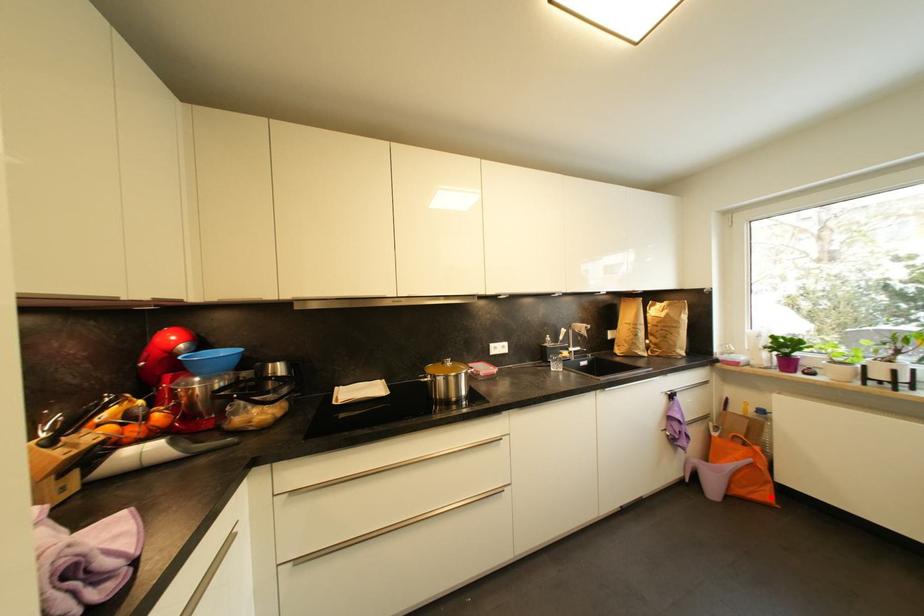
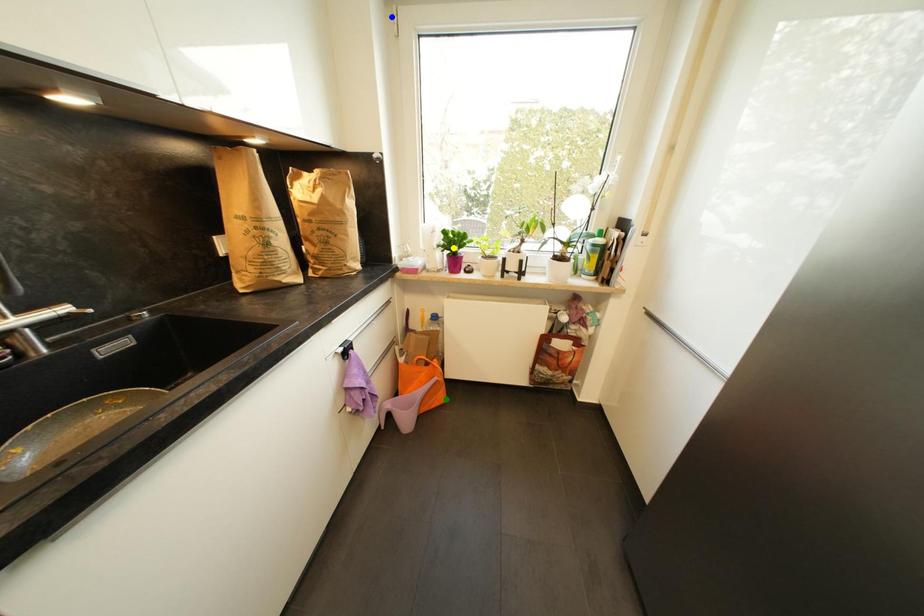
Question: I am providing you with two images of the same scene from different viewpoints. A red point is marked on the first image. You are given multiple points on the second image. Which point in image 2 is actually the same real-world point as the red point in image 1?

Choices:
 (A) green point
 (B) blue point
 (C) yellow point

Answer: (A)